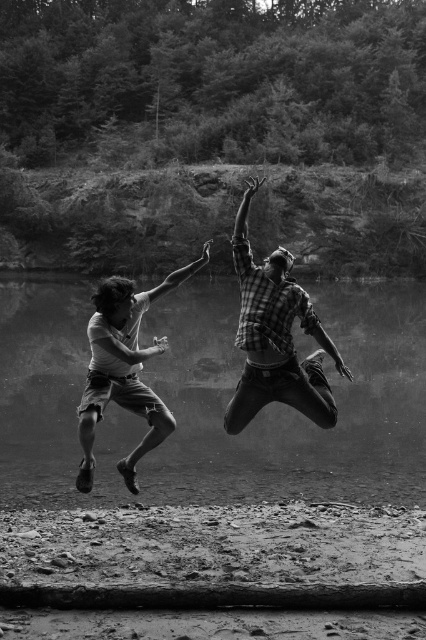
You are observing a black and white photo of two people jumping towards each other near a rocky shoreline. The scene includes a plaid shirt at center and a matte white shirt at center. Which shirt is positioned to the right of the other?

The plaid shirt at center is positioned on the right side of matte white shirt at center.

You are a photographer analyzing this black and white image. You notice two individuals jumping towards each other in the scene. Based on their positions, which of the two, the plaid shirt at center or the matte white shirt at center, is closer to the camera?

The plaid shirt at center is in front of the matte white shirt at center, so the plaid shirt at center is closer to the camera.

You are observing a photograph of two people jumping towards each other near a rocky shoreline. The image shows a plaid shirt at center and a matte white shirt at center. Based on their positions, which shirt is taller?

The plaid shirt at center has a greater height compared to the matte white shirt at center, so the plaid shirt at center is taller.